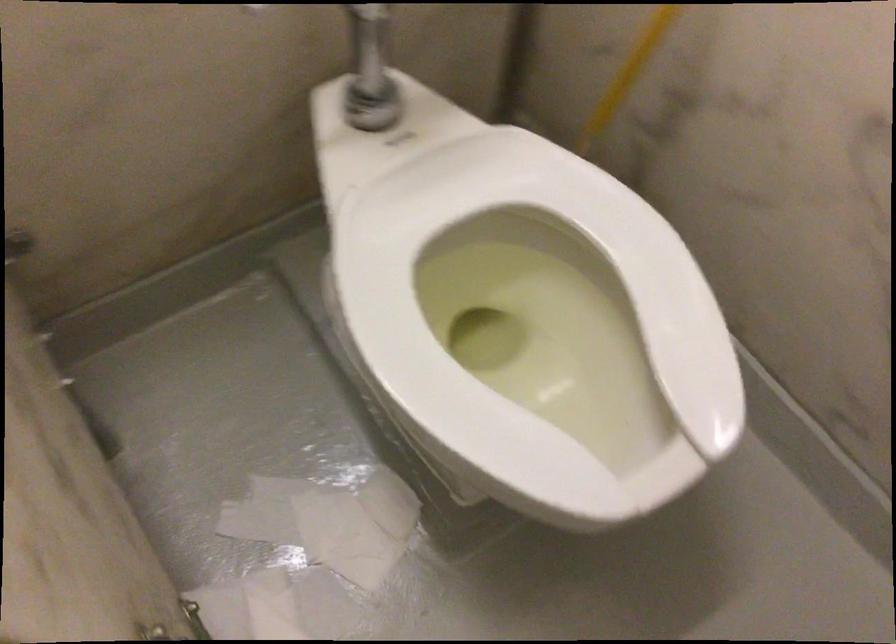
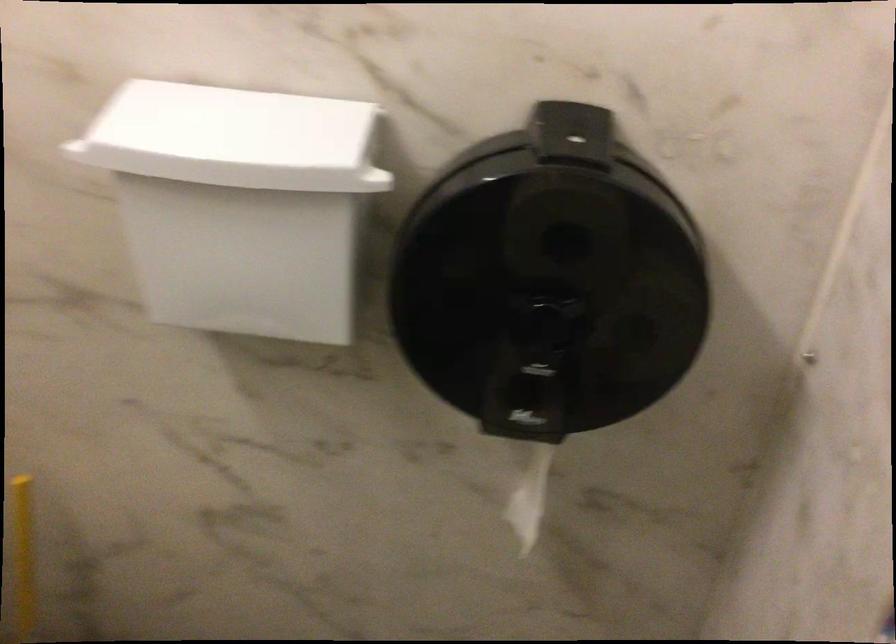
Question: How did the camera likely rotate?

Choices:
 (A) Left
 (B) Right
 (C) Up
 (D) Down

Answer: (B)